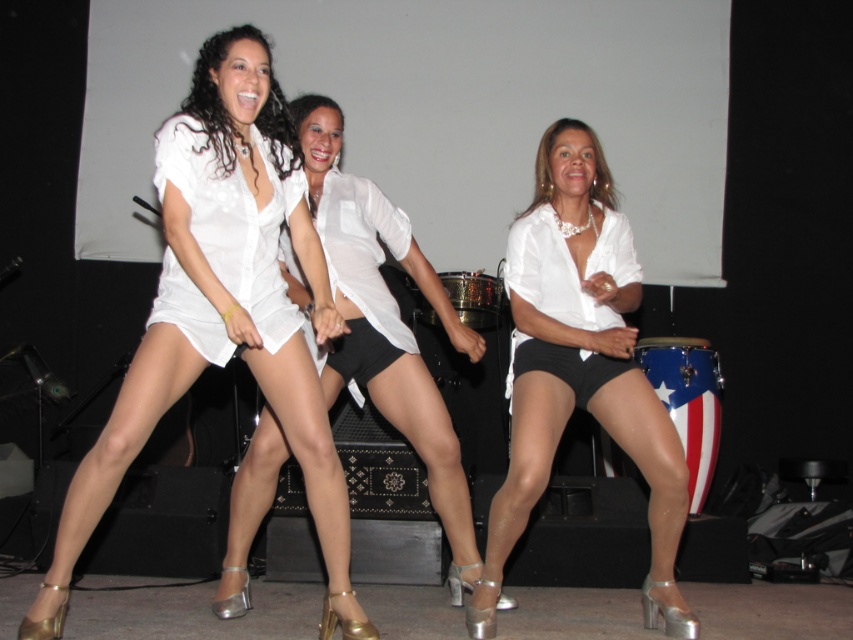
How far apart are white satin dress at center and white satin blouse at center?

white satin dress at center is 16.44 inches away from white satin blouse at center.

Describe the element at coordinates (223, 308) in the screenshot. The height and width of the screenshot is (640, 853). I see `white satin dress at center` at that location.

Locate an element on the screen. white satin dress at center is located at coordinates (223, 308).

Which of these two, white satin blouse at center or white sheer dress at center, stands shorter?

Standing shorter between the two is white sheer dress at center.

The width and height of the screenshot is (853, 640). Describe the element at coordinates (386, 323) in the screenshot. I see `white satin blouse at center` at that location.

Locate an element on the screen. The image size is (853, 640). white satin blouse at center is located at coordinates (386, 323).

What do you see at coordinates (223, 308) in the screenshot? I see `white satin dress at center` at bounding box center [223, 308].

Is white satin dress at center to the right of white glossy blouse at center from the viewer's perspective?

Incorrect, white satin dress at center is not on the right side of white glossy blouse at center.

Who is more distant from viewer, (212, 349) or (537, 260)?

The point (537, 260) is more distant.

In order to click on white satin dress at center in this screenshot , I will do `click(223, 308)`.